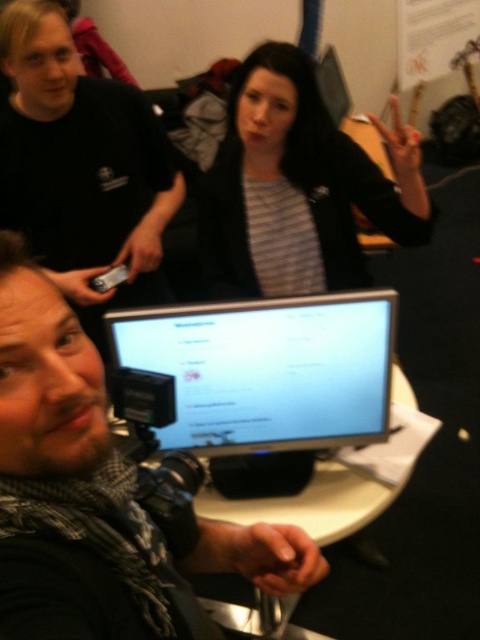
Does matte black camera at lower left appear under matte black monitor at center?

No, matte black camera at lower left is not below matte black monitor at center.

At what (x,y) coordinates should I click in order to perform the action: click on matte black camera at lower left. Please return your answer as a coordinate pair (x, y). The image size is (480, 640). Looking at the image, I should click on (82, 166).

Can you confirm if bearded man at center is positioned to the left of black matte jacket at upper center?

Indeed, bearded man at center is positioned on the left side of black matte jacket at upper center.

Between bearded man at center and black matte jacket at upper center, which one appears on the left side from the viewer's perspective?

From the viewer's perspective, bearded man at center appears more on the left side.

Identify the location of bearded man at center. The width and height of the screenshot is (480, 640). (100, 496).

Image resolution: width=480 pixels, height=640 pixels. I want to click on bearded man at center, so click(100, 496).

Image resolution: width=480 pixels, height=640 pixels. What are the coordinates of `black matte jacket at upper center` in the screenshot? It's located at (299, 186).

Is black matte jacket at upper center smaller than matte black monitor at center?

Incorrect, black matte jacket at upper center is not smaller in size than matte black monitor at center.

This screenshot has width=480, height=640. Identify the location of black matte jacket at upper center. [x=299, y=186].